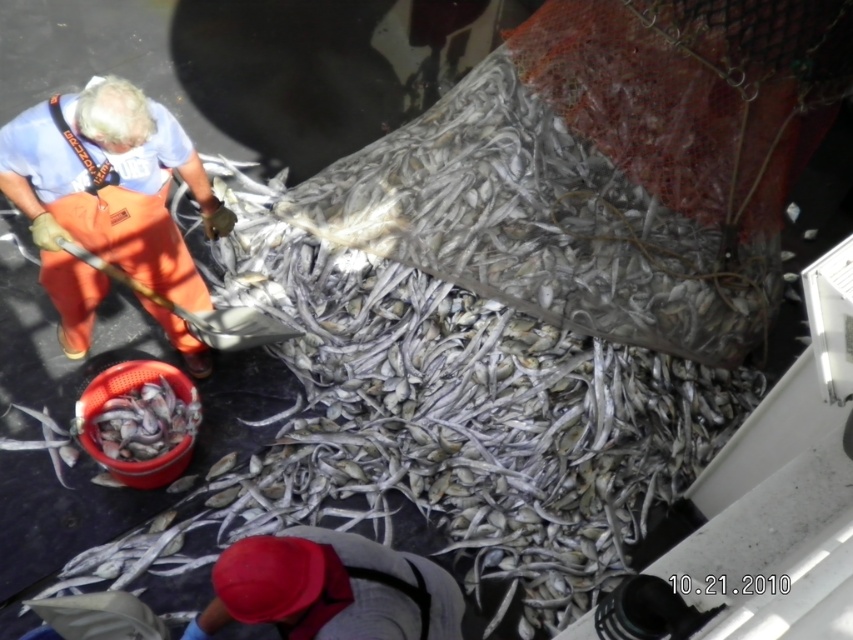
Question: Which point is farther to the camera?

Choices:
 (A) silvery metallic fish at lower left
 (B) orange fabric worker at left
 (C) gray fabric cap at lower center
 (D) silvery metallic fish at lower center

Answer: (A)

Question: Which of the following is the closest to the observer?

Choices:
 (A) orange fabric worker at left
 (B) silvery metallic fish at lower left
 (C) gray fabric cap at lower center

Answer: (C)

Question: Observing the image, what is the correct spatial positioning of orange fabric worker at left in reference to gray fabric cap at lower center?

Choices:
 (A) left
 (B) right

Answer: (A)

Question: Considering the relative positions of silvery metallic fish at lower center and silvery metallic fish at lower left in the image provided, where is silvery metallic fish at lower center located with respect to silvery metallic fish at lower left?

Choices:
 (A) left
 (B) right

Answer: (B)

Question: Can you confirm if gray fabric cap at lower center is positioned to the right of silvery metallic fish at lower center?

Choices:
 (A) no
 (B) yes

Answer: (B)

Question: Which point is closer to the camera taking this photo?

Choices:
 (A) (364, 612)
 (B) (155, 449)
 (C) (38, 412)

Answer: (A)